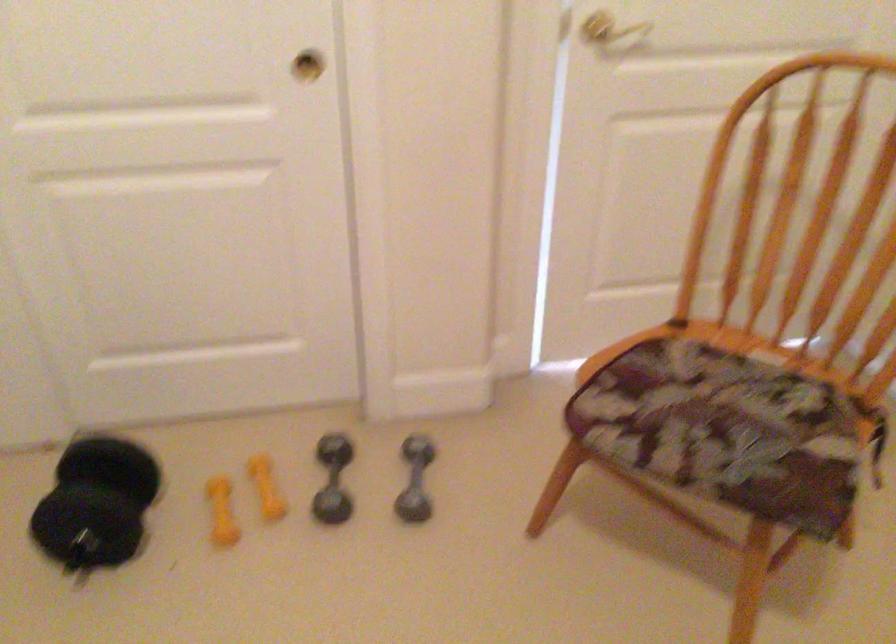
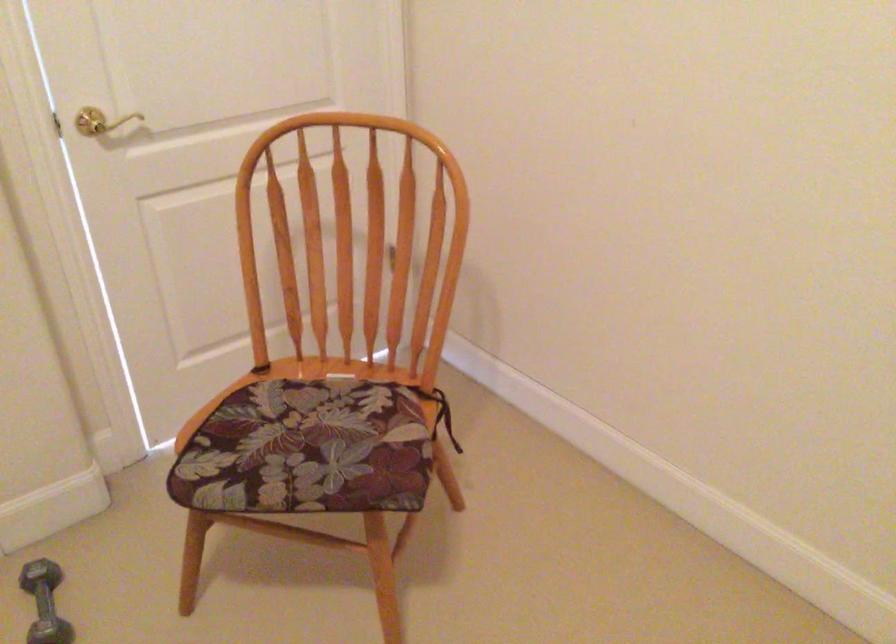
Question: How did the camera likely rotate?

Choices:
 (A) Left
 (B) Right
 (C) Up
 (D) Down

Answer: (B)